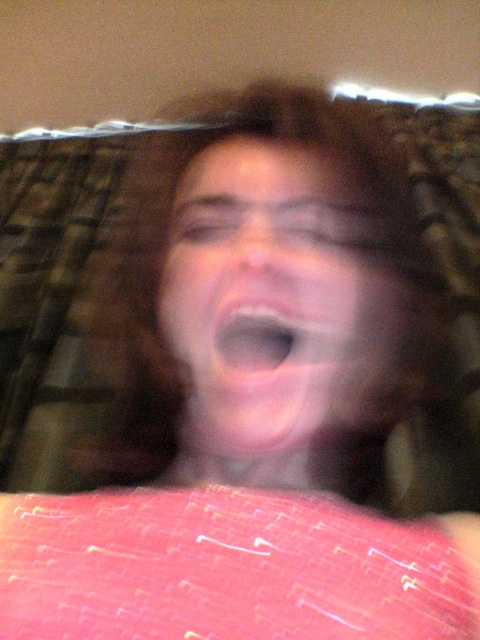
You are holding a 12 inch ruler and want to measure the distance from your eyes to the point at coordinates point (165, 291). Can you do it without moving your head?

The point at coordinates point (165, 291) is 18.11 inches away from the viewer, so yes, you can measure the distance with a 12 inch ruler since the ruler is shorter than the distance.